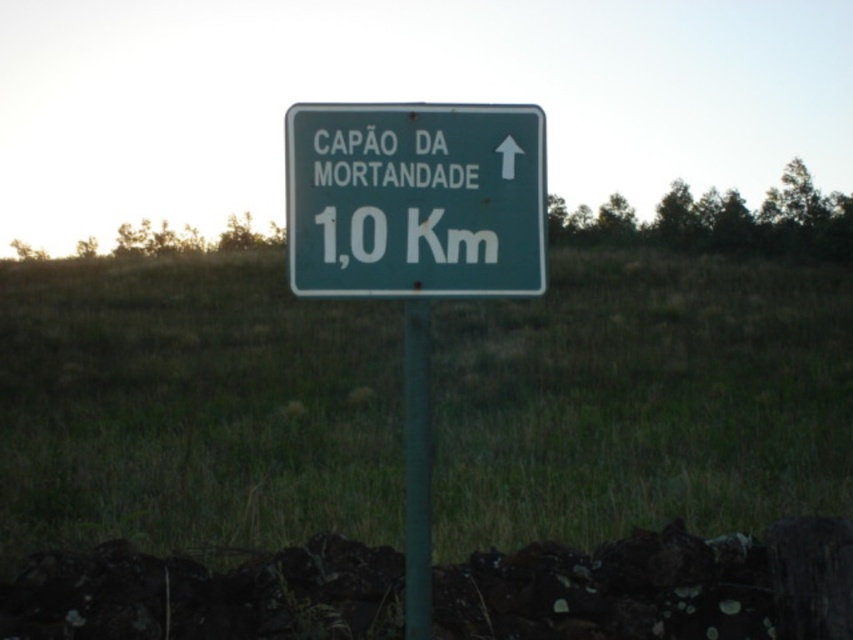
Does green grass at center have a lesser height compared to green metallic pole at center?

Incorrect, green grass at center's height does not fall short of green metallic pole at center's.

At what (x,y) coordinates should I click in order to perform the action: click on green grass at center. Please return your answer as a coordinate pair (x, y). Looking at the image, I should click on (642, 401).

Find the location of a particular element. The height and width of the screenshot is (640, 853). green grass at center is located at coordinates (642, 401).

Looking at this image, does green matte signpost at center appear on the right side of green metallic pole at center?

Incorrect, green matte signpost at center is not on the right side of green metallic pole at center.

Between point (503, 284) and point (410, 561), which one is positioned behind?

Point (410, 561)

This screenshot has width=853, height=640. I want to click on green matte signpost at center, so click(415, 241).

Identify the location of green grass at center. This screenshot has height=640, width=853. click(x=642, y=401).

Image resolution: width=853 pixels, height=640 pixels. What do you see at coordinates (642, 401) in the screenshot?
I see `green grass at center` at bounding box center [642, 401].

You are a GUI agent. You are given a task and a screenshot of the screen. Output one action in this format:
    pyautogui.click(x=<x>, y=<y>)
    Task: Click on the green grass at center
    The width and height of the screenshot is (853, 640).
    Given the screenshot: What is the action you would take?
    pyautogui.click(x=642, y=401)